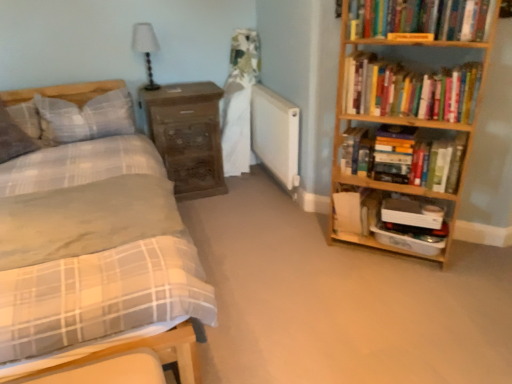
The width and height of the screenshot is (512, 384). What are the coordinates of `vacant area that is in front of wooden carved chest of drawers at center` in the screenshot? It's located at pyautogui.click(x=208, y=217).